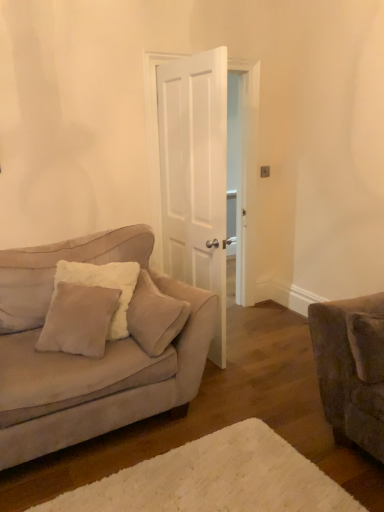
What is the approximate height of suede couch at left?

39.16 inches.

In order to click on beige plush pillow at left, which is counted as the first pillow, starting from the left in this screenshot , I will do `click(55, 270)`.

Find the location of a particular element. white fluffy rug at lower center is located at coordinates (215, 479).

Image resolution: width=384 pixels, height=512 pixels. What do you see at coordinates (154, 143) in the screenshot?
I see `white matte door at center` at bounding box center [154, 143].

At what (x,y) coordinates should I click in order to perform the action: click on suede couch at left. Please return your answer as a coordinate pair (x, y). The height and width of the screenshot is (512, 384). Looking at the image, I should click on tap(87, 357).

Could you tell me if white matte door at center is facing beige plush pillow at left, which is the 2th pillow from left to right?

No, white matte door at center is not oriented towards beige plush pillow at left, which is the 2th pillow from left to right.

Between white matte door at center and beige plush pillow at left, which is the 2th pillow from left to right, which one appears on the right side from the viewer's perspective?

white matte door at center is more to the right.

Is white matte door at center touching beige plush pillow at left, which is the 2th pillow from left to right?

No, white matte door at center is not with beige plush pillow at left, which is the 2th pillow from left to right.

From the image's perspective, is white matte door at center over beige plush pillow at left, which is the 2th pillow from left to right?

Yes, from the image's perspective, white matte door at center is over beige plush pillow at left, which is the 2th pillow from left to right.

Would you say suede-like beige pillow at lower right, which is counted as the first pillow, starting from the right, is outside suede couch at left?

Yes, suede-like beige pillow at lower right, which is counted as the first pillow, starting from the right, is not within suede couch at left.

From a real-world perspective, is suede-like beige pillow at lower right, the 3th pillow viewed from the left, above or below suede couch at left?

suede-like beige pillow at lower right, the 3th pillow viewed from the left, is above suede couch at left.

Identify the location of the 3rd pillow counting from the right of the suede couch at left. This screenshot has width=384, height=512. (367, 345).

Does suede-like beige pillow at lower right, the 3th pillow viewed from the left, turn towards suede couch at left?

No, suede-like beige pillow at lower right, the 3th pillow viewed from the left, is not turned towards suede couch at left.

Considering their positions, is suede couch at left located in front of or behind beige plush pillow at left, which is the 2th pillow from left to right?

suede couch at left is positioned closer to the viewer than beige plush pillow at left, which is the 2th pillow from left to right.

Does point (211, 317) come closer to viewer compared to point (147, 315)?

No.

From the image's perspective, which one is positioned lower, suede couch at left or beige plush pillow at left, marked as the second pillow in a right-to-left arrangement?

suede couch at left appears lower in the image.

Is suede couch at left beside beige plush pillow at left, marked as the second pillow in a right-to-left arrangement?

No, suede couch at left is not next to beige plush pillow at left, marked as the second pillow in a right-to-left arrangement.

From the image's perspective, which one is positioned higher, beige plush pillow at left, the 3th pillow from the right, or white fluffy rug at lower center?

beige plush pillow at left, the 3th pillow from the right, appears higher in the image.

Based on the photo, based on their sizes in the image, would you say beige plush pillow at left, the 3th pillow from the right, is bigger or smaller than white fluffy rug at lower center?

beige plush pillow at left, the 3th pillow from the right, is bigger than white fluffy rug at lower center.

Can you confirm if beige plush pillow at left, the 3th pillow from the right, is shorter than white fluffy rug at lower center?

No, beige plush pillow at left, the 3th pillow from the right, is not shorter than white fluffy rug at lower center.

Choose the correct answer: Is white matte door at center inside beige plush pillow at left, which is counted as the first pillow, starting from the left, or outside it?

white matte door at center exists outside the volume of beige plush pillow at left, which is counted as the first pillow, starting from the left.

From the picture: From the image's perspective, between white matte door at center and beige plush pillow at left, which is counted as the first pillow, starting from the left, who is located below?

beige plush pillow at left, which is counted as the first pillow, starting from the left.

From a real-world perspective, who is located higher, white matte door at center or beige plush pillow at left, which is counted as the first pillow, starting from the left?

white matte door at center, from a real-world perspective.

Is white matte door at center positioned before beige plush pillow at left, the 3th pillow from the right?

No, white matte door at center is further to the viewer.

In the scene shown: Can suede couch at left be found inside beige plush pillow at left, marked as the second pillow in a right-to-left arrangement?

No, suede couch at left is located outside of beige plush pillow at left, marked as the second pillow in a right-to-left arrangement.

Considering the relative sizes of beige plush pillow at left, marked as the second pillow in a right-to-left arrangement, and suede couch at left in the image provided, is beige plush pillow at left, marked as the second pillow in a right-to-left arrangement, shorter than suede couch at left?

Yes, beige plush pillow at left, marked as the second pillow in a right-to-left arrangement, is shorter than suede couch at left.

Is beige plush pillow at left, which is the 2th pillow from left to right, facing towards suede couch at left?

Yes, beige plush pillow at left, which is the 2th pillow from left to right, is oriented towards suede couch at left.

Which is in front, beige plush pillow at left, marked as the second pillow in a right-to-left arrangement, or suede couch at left?

suede couch at left is closer to the camera.

Considering the positions of objects white fluffy rug at lower center and beige plush pillow at left, the 3th pillow from the right, in the image provided, who is more to the right, white fluffy rug at lower center or beige plush pillow at left, the 3th pillow from the right,?

From the viewer's perspective, white fluffy rug at lower center appears more on the right side.

Is white fluffy rug at lower center not near beige plush pillow at left, the 3th pillow from the right?

Yes, white fluffy rug at lower center and beige plush pillow at left, the 3th pillow from the right, are located far from each other.

Which is in front, point (202, 480) or point (14, 273)?

The point (202, 480) is closer to the camera.

Between white fluffy rug at lower center and beige plush pillow at left, the 3th pillow from the right, which one is positioned in front?

white fluffy rug at lower center is more forward.

Image resolution: width=384 pixels, height=512 pixels. Find the location of `door lying above the beige plush pillow at left, marked as the second pillow in a right-to-left arrangement (from the image's perspective)`. door lying above the beige plush pillow at left, marked as the second pillow in a right-to-left arrangement (from the image's perspective) is located at coordinates (154, 143).

Locate an element on the screen. The image size is (384, 512). studio couch that is on the left side of suede-like beige pillow at lower right, the 3th pillow viewed from the left is located at coordinates (87, 357).

Considering their positions, is white matte door at center positioned closer to beige plush pillow at left, marked as the second pillow in a right-to-left arrangement, than suede-like beige pillow at lower right, the 3th pillow viewed from the left?

suede-like beige pillow at lower right, the 3th pillow viewed from the left, is closer to beige plush pillow at left, marked as the second pillow in a right-to-left arrangement.

Considering their positions, is white fluffy rug at lower center positioned closer to suede couch at left than white matte door at center?

Based on the image, white fluffy rug at lower center appears to be nearer to suede couch at left.

Based on their spatial positions, is white matte door at center or suede couch at left further from beige plush pillow at left, which is the 2th pillow from left to right?

white matte door at center is further to beige plush pillow at left, which is the 2th pillow from left to right.

Estimate the real-world distances between objects in this image. Which object is further from suede-like beige pillow at lower right, the 3th pillow viewed from the left, suede couch at left or beige plush pillow at left, which is the 2th pillow from left to right?

The object further to suede-like beige pillow at lower right, the 3th pillow viewed from the left, is suede couch at left.

Considering their positions, is white fluffy rug at lower center positioned closer to beige plush pillow at left, which is counted as the first pillow, starting from the left, than white matte door at center?

Based on the image, white matte door at center appears to be nearer to beige plush pillow at left, which is counted as the first pillow, starting from the left.

Based on their spatial positions, is suede-like beige pillow at lower right, the 3th pillow viewed from the left, or beige plush pillow at left, the 3th pillow from the right, further from beige plush pillow at left, marked as the second pillow in a right-to-left arrangement?

Based on the image, suede-like beige pillow at lower right, the 3th pillow viewed from the left, appears to be further to beige plush pillow at left, marked as the second pillow in a right-to-left arrangement.

From the picture: Considering their positions, is white matte door at center positioned closer to white fluffy rug at lower center than suede-like beige pillow at lower right, the 3th pillow viewed from the left?

suede-like beige pillow at lower right, the 3th pillow viewed from the left.

Looking at the image, which one is located further to suede couch at left, white matte door at center or white fluffy rug at lower center?

The object further to suede couch at left is white matte door at center.

You are a GUI agent. You are given a task and a screenshot of the screen. Output one action in this format:
    pyautogui.click(x=<x>, y=<y>)
    Task: Click on the pillow situated between beige plush pillow at left, which is counted as the first pillow, starting from the left, and suede-like beige pillow at lower right, the 3th pillow viewed from the left, from left to right
    
    Given the screenshot: What is the action you would take?
    pyautogui.click(x=154, y=316)

Find the location of a particular element. The image size is (384, 512). door between beige plush pillow at left, marked as the second pillow in a right-to-left arrangement, and suede-like beige pillow at lower right, the 3th pillow viewed from the left, in the horizontal direction is located at coordinates (154, 143).

The height and width of the screenshot is (512, 384). Find the location of `studio couch that lies between beige plush pillow at left, marked as the second pillow in a right-to-left arrangement, and white fluffy rug at lower center from top to bottom`. studio couch that lies between beige plush pillow at left, marked as the second pillow in a right-to-left arrangement, and white fluffy rug at lower center from top to bottom is located at coordinates (87, 357).

This screenshot has height=512, width=384. In order to click on plain between suede couch at left and suede-like beige pillow at lower right, the 3th pillow viewed from the left in this screenshot , I will do `click(215, 479)`.